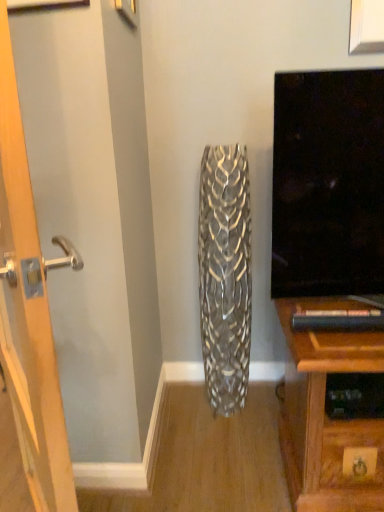
Question: In terms of height, does silver metallic vase at center look taller or shorter compared to wooden door at left?

Choices:
 (A) tall
 (B) short

Answer: (B)

Question: From the image's perspective, is silver metallic vase at center located above or below wooden door at left?

Choices:
 (A) above
 (B) below

Answer: (A)

Question: In the image, is silver metallic vase at center positioned in front of or behind wooden door at left?

Choices:
 (A) behind
 (B) front

Answer: (A)

Question: In the image, is wooden door at left positioned in front of or behind silver metallic vase at center?

Choices:
 (A) front
 (B) behind

Answer: (A)

Question: From the image's perspective, is wooden door at left above or below silver metallic vase at center?

Choices:
 (A) below
 (B) above

Answer: (A)

Question: From a real-world perspective, is wooden door at left physically located above or below silver metallic vase at center?

Choices:
 (A) below
 (B) above

Answer: (B)

Question: Is wooden door at left taller or shorter than silver metallic vase at center?

Choices:
 (A) short
 (B) tall

Answer: (B)